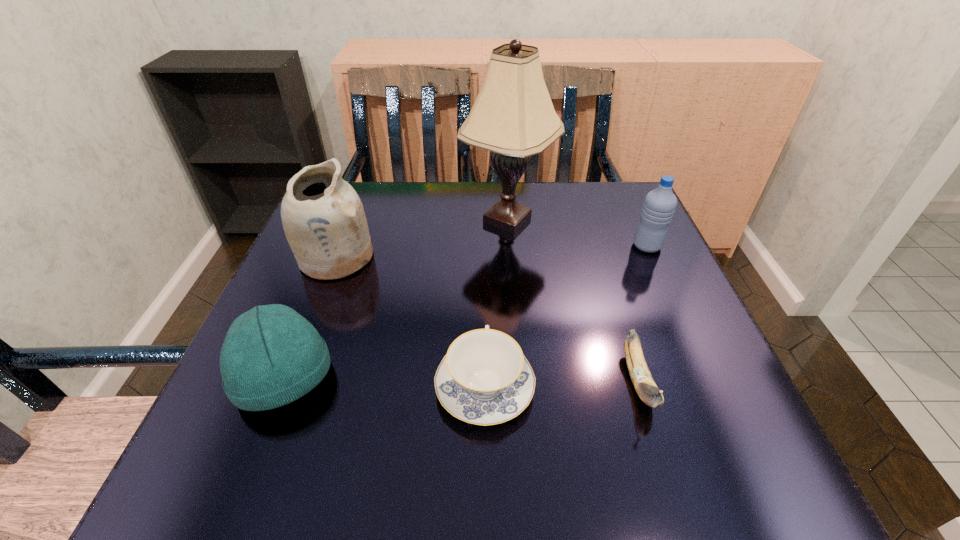
Identify the location of empty space that is in between the lamp and the second object from right to left. This screenshot has height=540, width=960. pyautogui.click(x=573, y=300).

At what (x,y) coordinates should I click in order to perform the action: click on free area in between the chinaware and the third shortest object. Please return your answer as a coordinate pair (x, y). Image resolution: width=960 pixels, height=540 pixels. Looking at the image, I should click on (385, 382).

At what (x,y) coordinates should I click in order to perform the action: click on free space between the water bottle and the beanie. Please return your answer as a coordinate pair (x, y). The height and width of the screenshot is (540, 960). Looking at the image, I should click on (466, 312).

The height and width of the screenshot is (540, 960). In order to click on free point between the third shortest object and the fifth shortest object in this screenshot , I will do `click(310, 318)`.

Locate an element on the screen. empty space that is in between the chinaware and the beanie is located at coordinates (385, 382).

Where is `free spot between the chinaware and the third shortest object`? The height and width of the screenshot is (540, 960). free spot between the chinaware and the third shortest object is located at coordinates (385, 382).

Image resolution: width=960 pixels, height=540 pixels. I want to click on vacant point located between the tallest object and the chinaware, so click(496, 303).

Locate which object is the closest to the fourth shortest object. Please provide its 2D coordinates. Your answer should be formatted as a tuple, i.e. [(x, y)], where the tuple contains the x and y coordinates of a point satisfying the conditions above.

[(513, 116)]

Image resolution: width=960 pixels, height=540 pixels. What are the coordinates of `object that is the second closest to the chinaware` in the screenshot? It's located at coord(271,356).

In order to click on vacant space that satisfies the following two spatial constraints: 1. with the handle on the side of the chinaware; 2. on the left side of the fourth shortest object in this screenshot , I will do `click(484, 246)`.